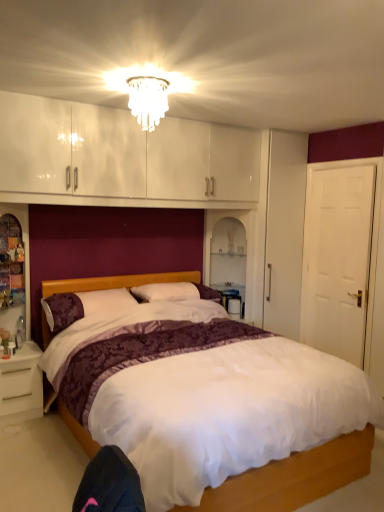
Where is `empty space that is ontop of white glossy nightstand at lower left (from a real-world perspective)`? This screenshot has height=512, width=384. empty space that is ontop of white glossy nightstand at lower left (from a real-world perspective) is located at coordinates (16, 354).